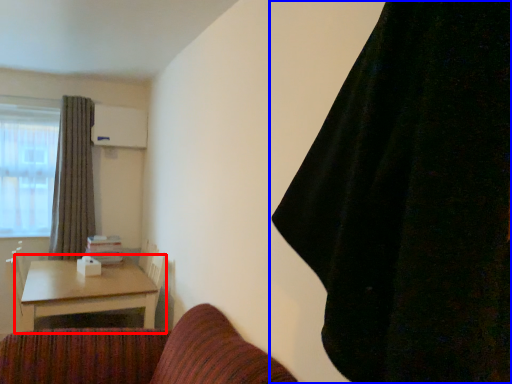
Question: Which point is closer to the camera, table (highlighted by a red box) or curtain (highlighted by a blue box)?

Choices:
 (A) table
 (B) curtain

Answer: (B)